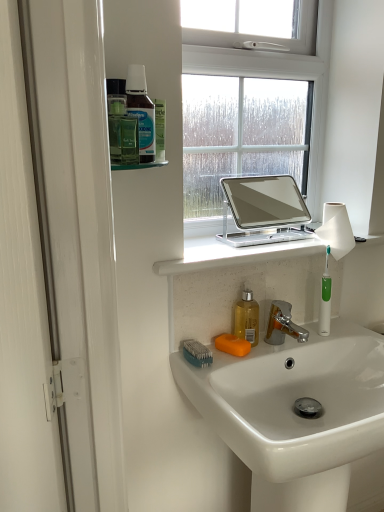
Describe the element at coordinates (232, 345) in the screenshot. Image resolution: width=384 pixels, height=512 pixels. I see `orange matte soap at sink` at that location.

The height and width of the screenshot is (512, 384). Describe the element at coordinates (141, 111) in the screenshot. I see `translucent plastic bottle at upper left, arranged as the second mouthwash when viewed from the right` at that location.

In order to face translucent plastic bottle at upper left, arranged as the second mouthwash when viewed from the right, should I rotate leftwards or rightwards?

To face it directly, rotate left by 7.145 degrees.

What do you see at coordinates (197, 353) in the screenshot? I see `green plastic toothbrush at lower center` at bounding box center [197, 353].

At what (x,y) coordinates should I click in order to perform the action: click on orange matte soap at sink. Please return your answer as a coordinate pair (x, y). Looking at the image, I should click on (232, 345).

Which object is further away from the camera taking this photo, translucent yellow liquid at sink, positioned as the 2th mouthwash in left-to-right order, or green plastic toothbrush at right?

green plastic toothbrush at right is further away from the camera.

Looking at their sizes, would you say translucent yellow liquid at sink, which is the first mouthwash from bottom to top, is wider or thinner than green plastic toothbrush at right?

Considering their sizes, translucent yellow liquid at sink, which is the first mouthwash from bottom to top, looks broader than green plastic toothbrush at right.

Are translucent yellow liquid at sink, acting as the 1th mouthwash starting from the back, and green plastic toothbrush at right located far from each other?

No, there isn't a large distance between translucent yellow liquid at sink, acting as the 1th mouthwash starting from the back, and green plastic toothbrush at right.

Is green plastic toothbrush at right facing towards translucent plastic bottle at upper left, the first mouthwash when ordered from left to right?

No.

Is green plastic toothbrush at right in front of or behind translucent plastic bottle at upper left, arranged as the second mouthwash when viewed from the right, in the image?

green plastic toothbrush at right is behind translucent plastic bottle at upper left, arranged as the second mouthwash when viewed from the right.

From a real-world perspective, which is physically below, green plastic toothbrush at right or translucent plastic bottle at upper left, placed as the second mouthwash when sorted from bottom to top?

From a 3D spatial view, green plastic toothbrush at right is below.

From a real-world perspective, between white glossy sink at lower center and translucent plastic bottle at upper left, the 1th mouthwash positioned from the front, who is vertically higher?

translucent plastic bottle at upper left, the 1th mouthwash positioned from the front, is physically above.

Which point is more distant from viewer, (299, 421) or (153, 149)?

The point (299, 421) is farther.

Considering the positions of objects white glossy sink at lower center and translucent plastic bottle at upper left, the first mouthwash when ordered from left to right, in the image provided, who is in front, white glossy sink at lower center or translucent plastic bottle at upper left, the first mouthwash when ordered from left to right,?

white glossy sink at lower center is closer to the camera.

From the picture: Is white glossy sink at lower center wider than translucent plastic bottle at upper left, placed as the second mouthwash when sorted from bottom to top?

Indeed, white glossy sink at lower center has a greater width compared to translucent plastic bottle at upper left, placed as the second mouthwash when sorted from bottom to top.

Could you tell me if translucent yellow liquid at sink, positioned as the 2th mouthwash in left-to-right order, is turned towards translucent plastic bottle at upper left, the first mouthwash when ordered from left to right?

No, translucent yellow liquid at sink, positioned as the 2th mouthwash in left-to-right order, is not facing towards translucent plastic bottle at upper left, the first mouthwash when ordered from left to right.

Considering the relative sizes of translucent yellow liquid at sink, the 1th mouthwash when ordered from right to left, and translucent plastic bottle at upper left, the first mouthwash when ordered from left to right, in the image provided, is translucent yellow liquid at sink, the 1th mouthwash when ordered from right to left, smaller than translucent plastic bottle at upper left, the first mouthwash when ordered from left to right,?

No.

Based on the photo, can you tell me how much translucent yellow liquid at sink, positioned as the 2th mouthwash in left-to-right order, and translucent plastic bottle at upper left, the first mouthwash when ordered from left to right, differ in facing direction?

0.79 degrees.

Looking at this image, is translucent yellow liquid at sink, the 1th mouthwash when ordered from right to left, thinner than translucent plastic bottle at upper left, the first mouthwash viewed from the top?

No, translucent yellow liquid at sink, the 1th mouthwash when ordered from right to left, is not thinner than translucent plastic bottle at upper left, the first mouthwash viewed from the top.

From the image's perspective, is translucent yellow liquid at sink, positioned as the 2th mouthwash in left-to-right order, above orange matte soap at sink?

Correct, translucent yellow liquid at sink, positioned as the 2th mouthwash in left-to-right order, appears higher than orange matte soap at sink in the image.

Between translucent yellow liquid at sink, which appears as the 2th mouthwash when viewed from the front, and orange matte soap at sink, which one has larger size?

translucent yellow liquid at sink, which appears as the 2th mouthwash when viewed from the front, is bigger.

Is translucent yellow liquid at sink, positioned as the 2th mouthwash in left-to-right order, completely or partially outside of orange matte soap at sink?

translucent yellow liquid at sink, positioned as the 2th mouthwash in left-to-right order, lies outside orange matte soap at sink's area.

From the image's perspective, would you say orange matte soap at sink is shown under green plastic toothbrush at right?

Indeed, from the image's perspective, orange matte soap at sink is shown beneath green plastic toothbrush at right.

Where is `toothbrush to the right of orange matte soap at sink`? The width and height of the screenshot is (384, 512). toothbrush to the right of orange matte soap at sink is located at coordinates (325, 298).

How much distance is there between orange matte soap at sink and green plastic toothbrush at right?

orange matte soap at sink is 9.96 inches from green plastic toothbrush at right.

Considering the relative sizes of orange matte soap at sink and green plastic toothbrush at right in the image provided, is orange matte soap at sink bigger than green plastic toothbrush at right?

Actually, orange matte soap at sink might be smaller than green plastic toothbrush at right.

Is orange matte soap at sink inside or outside of translucent yellow liquid at sink, positioned as the 2th mouthwash in left-to-right order?

orange matte soap at sink is spatially situated outside translucent yellow liquid at sink, positioned as the 2th mouthwash in left-to-right order.

Is orange matte soap at sink far from translucent yellow liquid at sink, which appears as the 2th mouthwash when viewed from the front?

No, orange matte soap at sink is not far away from translucent yellow liquid at sink, which appears as the 2th mouthwash when viewed from the front.

From a real-world perspective, is orange matte soap at sink above or below translucent yellow liquid at sink, positioned as the 2th mouthwash in top-to-bottom order?

From a real-world perspective, orange matte soap at sink is physically below translucent yellow liquid at sink, positioned as the 2th mouthwash in top-to-bottom order.

From a real-world perspective, which mouthwash is the 1st one above the orange matte soap at sink? Please provide its 2D coordinates.

[(247, 318)]

You are a GUI agent. You are given a task and a screenshot of the screen. Output one action in this format:
    pyautogui.click(x=<x>, y=<y>)
    Task: Click on the toothbrush that is above the translucent yellow liquid at sink, positioned as the 2th mouthwash in top-to-bottom order (from a real-world perspective)
    This screenshot has height=512, width=384.
    Given the screenshot: What is the action you would take?
    pyautogui.click(x=325, y=298)

I want to click on the 2nd mouthwash counting from the left side of the green plastic toothbrush at right, so click(x=141, y=111).

From the image, which object appears to be nearer to translucent plastic bottle at upper left, the first mouthwash when ordered from left to right, translucent yellow liquid at sink, which appears as the 2th mouthwash when viewed from the front, or green plastic toothbrush at lower center?

green plastic toothbrush at lower center is positioned closer to the anchor translucent plastic bottle at upper left, the first mouthwash when ordered from left to right.

Considering their positions, is orange matte soap at sink positioned closer to translucent plastic bottle at upper left, the first mouthwash viewed from the top, than translucent yellow liquid at sink, which appears as the 2th mouthwash when viewed from the front?

Based on the image, translucent yellow liquid at sink, which appears as the 2th mouthwash when viewed from the front, appears to be nearer to translucent plastic bottle at upper left, the first mouthwash viewed from the top.

From the image, which object appears to be nearer to green plastic toothbrush at lower center, green plastic toothbrush at right or translucent yellow liquid at sink, positioned as the 2th mouthwash in left-to-right order?

translucent yellow liquid at sink, positioned as the 2th mouthwash in left-to-right order, is closer to green plastic toothbrush at lower center.

Consider the image. Considering their positions, is white glossy sink at lower center positioned further to translucent yellow liquid at sink, acting as the 1th mouthwash starting from the back, than white stone window sill at center?

Based on the image, white glossy sink at lower center appears to be further to translucent yellow liquid at sink, acting as the 1th mouthwash starting from the back.

Looking at the image, which one is located closer to translucent yellow liquid at sink, which appears as the 2th mouthwash when viewed from the front, green plastic toothbrush at lower center or white stone window sill at center?

green plastic toothbrush at lower center is positioned closer to the anchor translucent yellow liquid at sink, which appears as the 2th mouthwash when viewed from the front.

Which object lies further to the anchor point orange matte soap at sink, translucent yellow liquid at sink, the 1th mouthwash when ordered from right to left, or white glossy sink at lower center?

white glossy sink at lower center lies further to orange matte soap at sink than the other object.

Estimate the real-world distances between objects in this image. Which object is further from translucent plastic bottle at upper left, arranged as the second mouthwash when viewed from the right, green plastic toothbrush at lower center or orange matte soap at sink?

orange matte soap at sink is further to translucent plastic bottle at upper left, arranged as the second mouthwash when viewed from the right.

Looking at the image, which one is located further to translucent yellow liquid at sink, which is the first mouthwash from bottom to top, green plastic toothbrush at right or orange matte soap at sink?

green plastic toothbrush at right is positioned further to the anchor translucent yellow liquid at sink, which is the first mouthwash from bottom to top.

Where is `window sill between translucent plastic bottle at upper left, the first mouthwash viewed from the top, and white glossy sink at lower center, in the vertical direction`? window sill between translucent plastic bottle at upper left, the first mouthwash viewed from the top, and white glossy sink at lower center, in the vertical direction is located at coordinates (233, 255).

Where is `mouthwash between translucent plastic bottle at upper left, the 1th mouthwash positioned from the front, and white glossy sink at lower center in the up-down direction`? mouthwash between translucent plastic bottle at upper left, the 1th mouthwash positioned from the front, and white glossy sink at lower center in the up-down direction is located at coordinates (247, 318).

Where is `mouthwash that lies between white stone window sill at center and green plastic toothbrush at lower center from top to bottom`? The image size is (384, 512). mouthwash that lies between white stone window sill at center and green plastic toothbrush at lower center from top to bottom is located at coordinates (247, 318).

What are the coordinates of `soap located between green plastic toothbrush at lower center and translucent yellow liquid at sink, which appears as the 2th mouthwash when viewed from the front, in the left-right direction` in the screenshot? It's located at (232, 345).